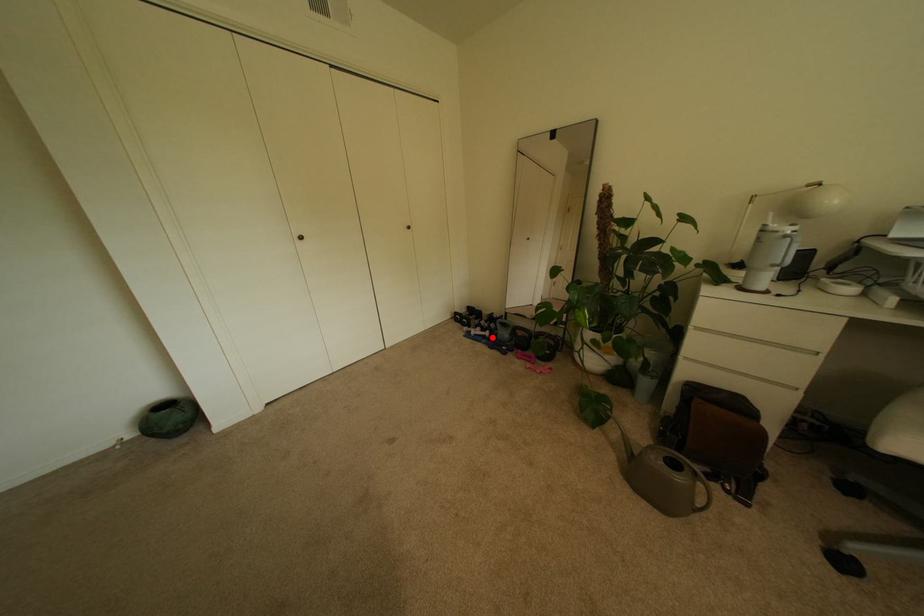
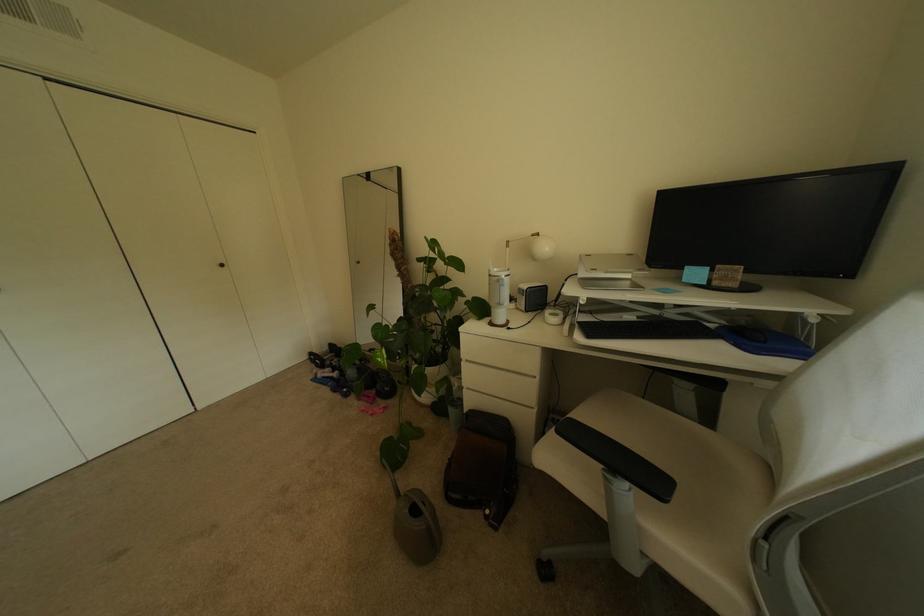
In the second image, find the point that corresponds to the highlighted location in the first image.

(341, 379)